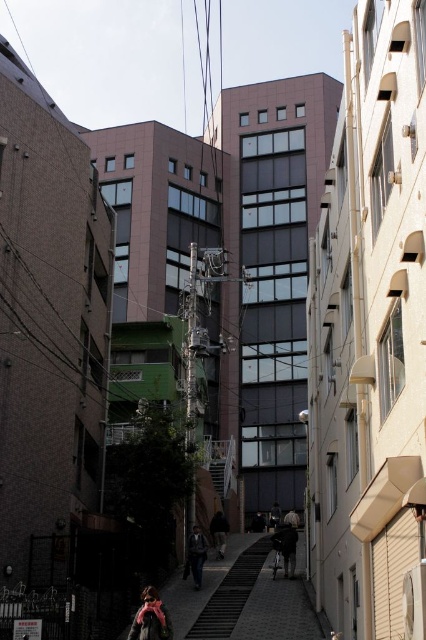
You are navigating through the narrow alleyway and need to reach the end. There are two points marked on your map at coordinates point (203,556) and point (216,554). Which point should you approach first if you want to move forward along the alley?

Point (203,556) should be approached first because it is in front of point (216,554) along the alleyway path.